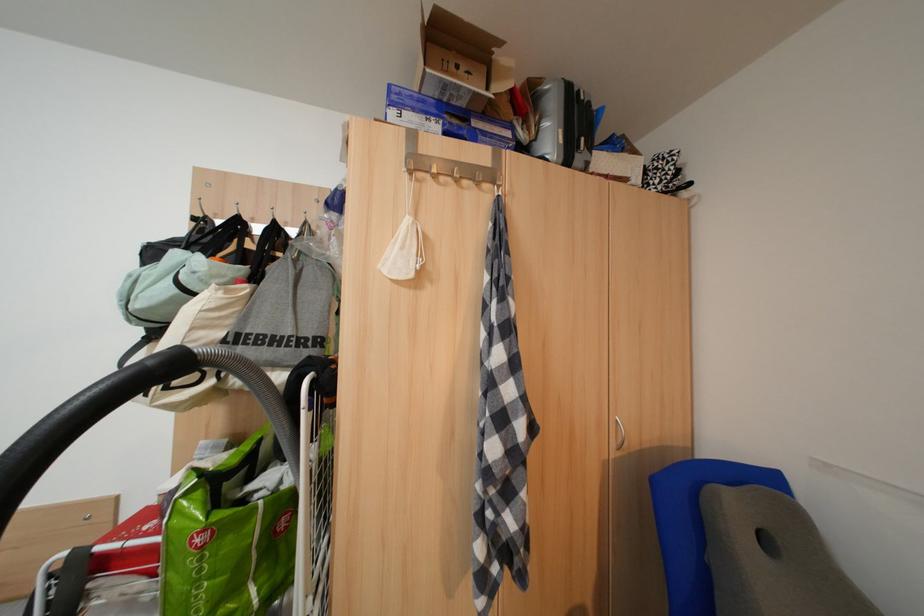
The image size is (924, 616). I want to click on metal wall hook, so click(451, 169).